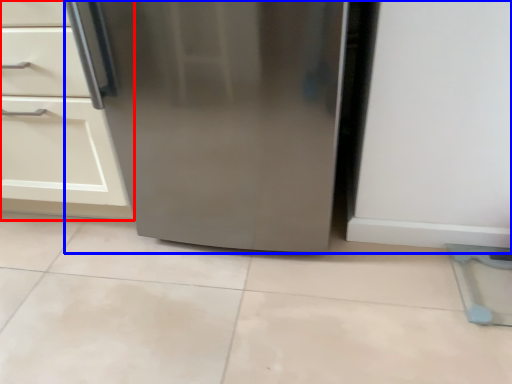
Question: Which point is closer to the camera, cabinetry (highlighted by a red box) or refrigerator (highlighted by a blue box)?

Choices:
 (A) cabinetry
 (B) refrigerator

Answer: (B)